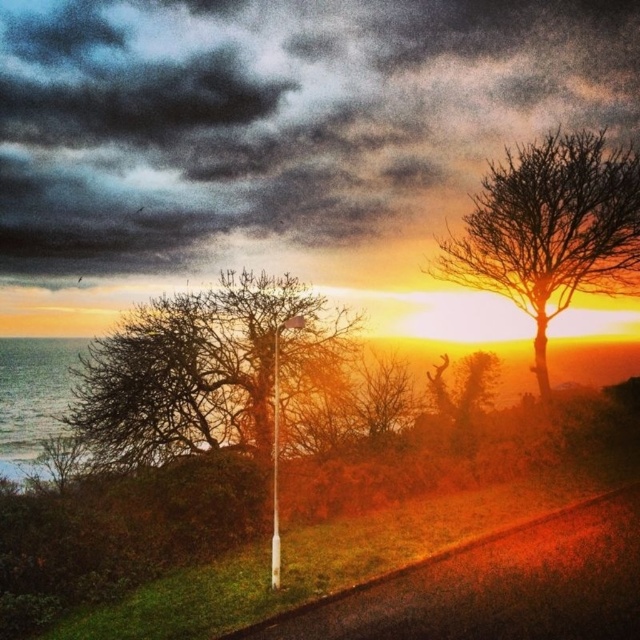
You are an artist planning to paint the coastal scene. You want to ensure the bare branches at left and the bare branches at upper right are proportionally accurate. Which set of branches should you make wider in your painting?

The bare branches at upper right should be wider in the painting since their width is greater than the bare branches at left according to the description.

You are standing on the grassy area near the white lamppost and want to take a photo of both the bare branches at left and the bare branches at upper right. Which set of branches should you focus on first to ensure they are in sharp focus without adjusting your camera settings?

You should focus on the bare branches at left first because they are closer to the viewer than the bare branches at upper right. Since they are closer, focusing on them will ensure they are in sharp focus, and the branches further away may still be acceptably sharp depending on the depth of field.

You are an artist sketching this coastal scene. You want to place the bare branches at left and the bare branches at upper right in your drawing. Based on the scene, which bare branches are positioned to the left of the other?

The bare branches at left are positioned to the left of the bare branches at upper right.